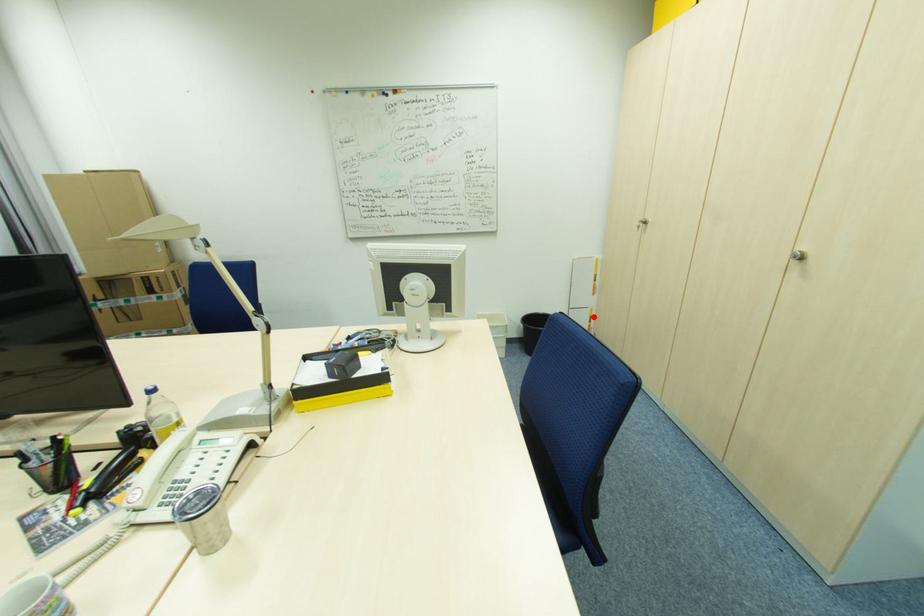
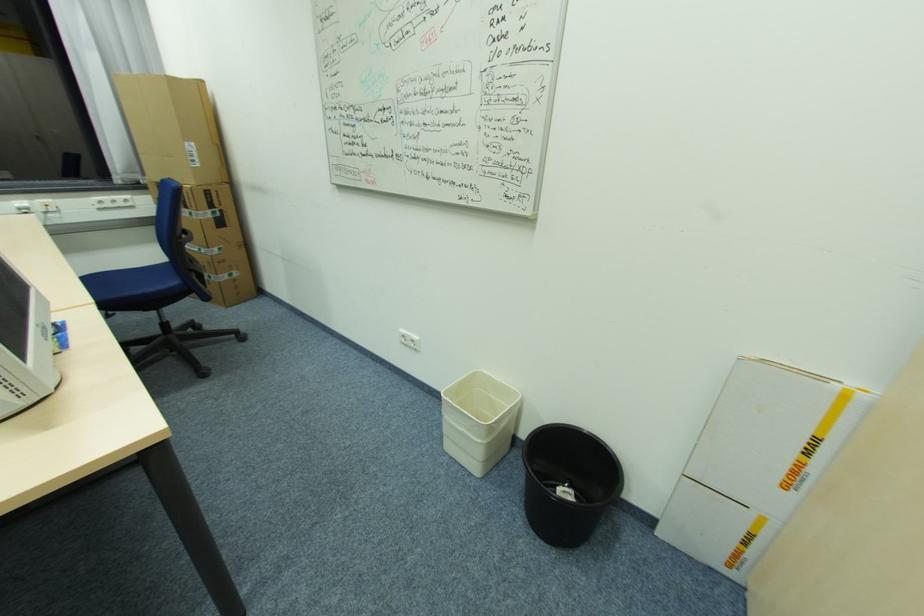
Question: I am providing you with two images of the same scene from different viewpoints. Given a red point in image1, look at the same physical point in image2. Is it:

Choices:
 (A) Closer to the viewpoint
 (B) Farther from the viewpoint

Answer: (A)